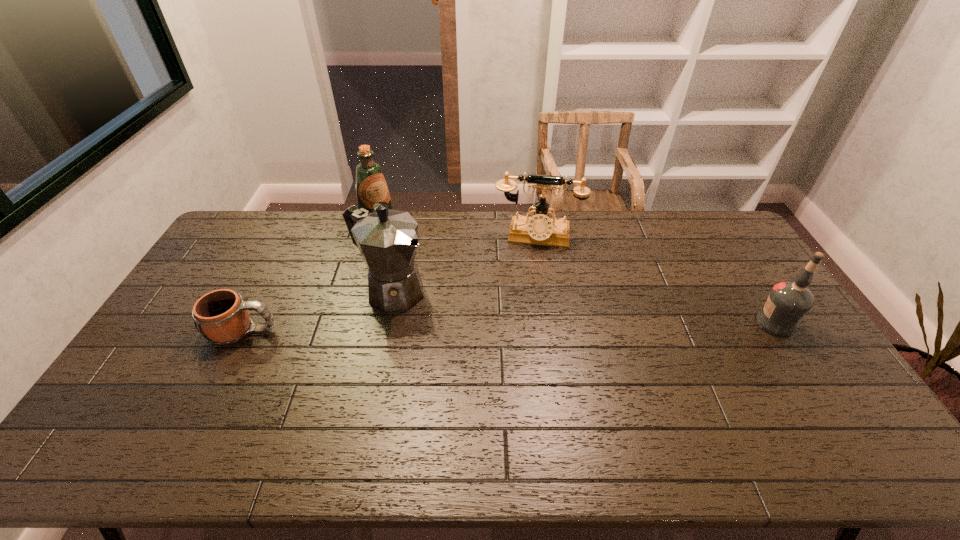
You are a GUI agent. You are given a task and a screenshot of the screen. Output one action in this format:
    pyautogui.click(x=<x>, y=<y>)
    Task: Click on the mug
    Image resolution: width=960 pixels, height=540 pixels.
    Given the screenshot: What is the action you would take?
    pyautogui.click(x=221, y=316)

Identify the location of the leftmost object. (221, 316).

Identify the location of the rightmost object. Image resolution: width=960 pixels, height=540 pixels. pyautogui.click(x=788, y=301).

The height and width of the screenshot is (540, 960). In order to click on olive oil in this screenshot , I will do `click(371, 187)`.

Identify the location of telephone. This screenshot has width=960, height=540. (539, 229).

Where is `coffeepot`? This screenshot has height=540, width=960. coffeepot is located at coordinates (387, 239).

At what (x,y) coordinates should I click in order to perform the action: click on vacant region located 0.300m on the side of the mug with the handle. Please return your answer as a coordinate pair (x, y). Looking at the image, I should click on (379, 332).

Where is `vacant space positioned 0.400m on the front label of the vodka`? vacant space positioned 0.400m on the front label of the vodka is located at coordinates pyautogui.click(x=625, y=323).

Where is `free space located on the front label of the vodka`? The width and height of the screenshot is (960, 540). free space located on the front label of the vodka is located at coordinates (724, 323).

The image size is (960, 540). I want to click on vacant point located on the front label of the vodka, so pos(731,323).